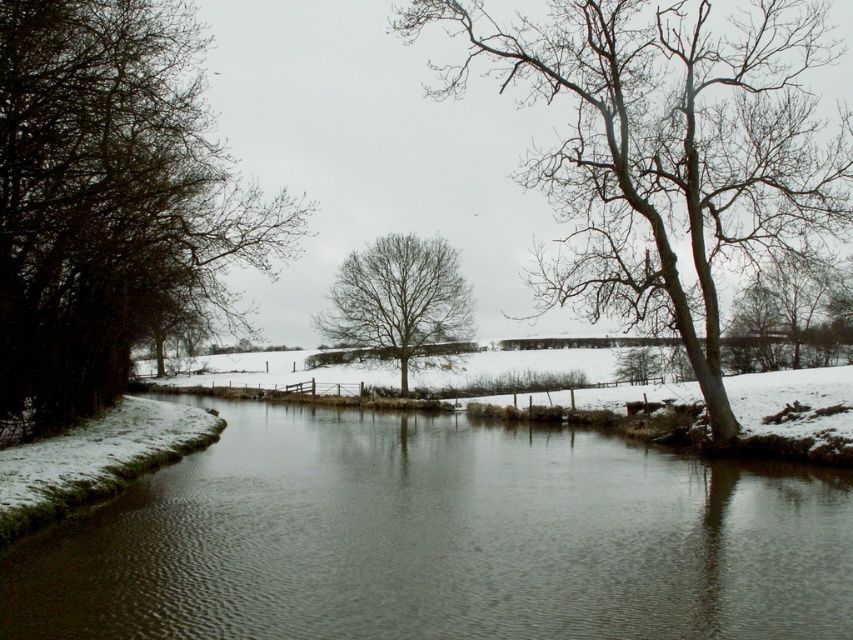
Between bare wood tree at right and bare wood tree at center, which one is positioned higher?

Positioned higher is bare wood tree at right.

Does bare wood tree at right appear on the left side of bare wood tree at center?

No, bare wood tree at right is not to the left of bare wood tree at center.

Measure the distance between bare wood tree at right and camera.

bare wood tree at right and camera are 24.35 meters apart.

This screenshot has height=640, width=853. What are the coordinates of `bare wood tree at right` in the screenshot? It's located at (665, 150).

Which is more to the right, dark green leafless tree at left or bare wood tree at center?

bare wood tree at center

Between point (199, 273) and point (376, 321), which one is positioned behind?

Point (376, 321)

Identify the location of dark green leafless tree at left. (111, 202).

The height and width of the screenshot is (640, 853). In order to click on dark green leafless tree at left in this screenshot , I will do `click(111, 202)`.

Is brown smooth water at center to the left of dark green leafless tree at left from the viewer's perspective?

No, brown smooth water at center is not to the left of dark green leafless tree at left.

Does brown smooth water at center have a greater width compared to dark green leafless tree at left?

Indeed, brown smooth water at center has a greater width compared to dark green leafless tree at left.

Is point (498, 456) positioned after point (207, 216)?

That is False.

Where is `brown smooth water at center`? brown smooth water at center is located at coordinates (440, 538).